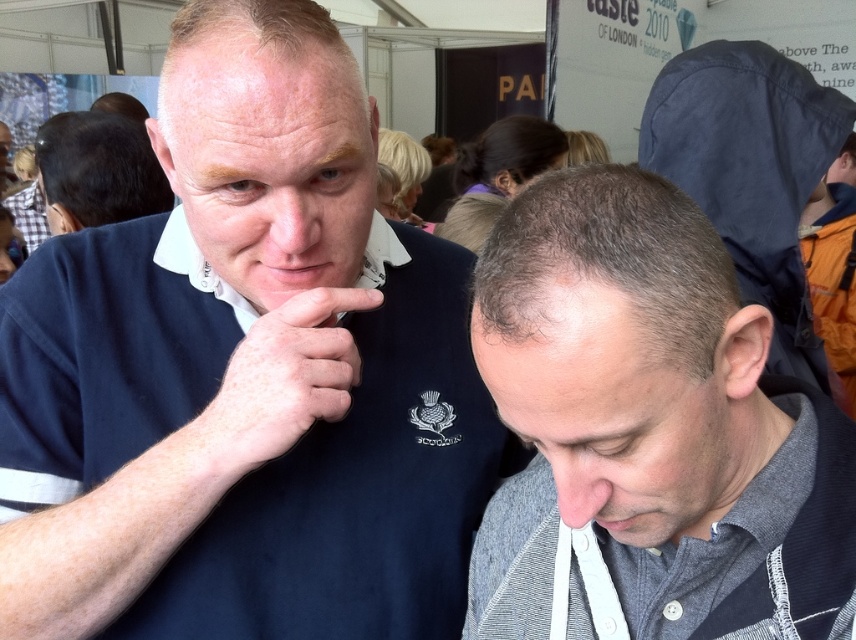
You are a photographer at the event and want to ensure both the black matte hair at upper left and the matte skin nose at center are clearly visible in your photo. Given their sizes, which object should you focus on first to ensure sharpness?

The black matte hair at upper left is larger in size than the matte skin nose at center, so focusing on the black matte hair at upper left first would help ensure both are sharp since it requires less precision due to its larger size.

What does the point at coordinates [284,378] in the image represent?

The point at coordinates [284,378] corresponds to the pale skin and hair of the person at the center of the image.